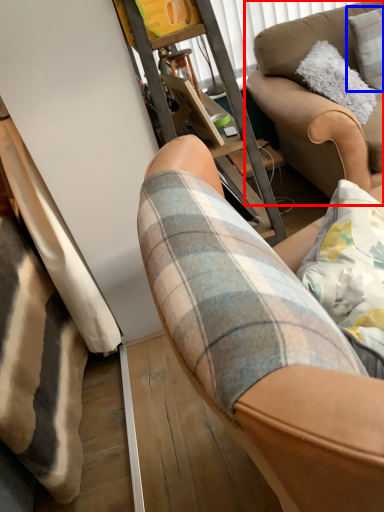
Question: Which of the following is the farthest to the observer, studio couch (highlighted by a red box) or pillow (highlighted by a blue box)?

Choices:
 (A) studio couch
 (B) pillow

Answer: (B)